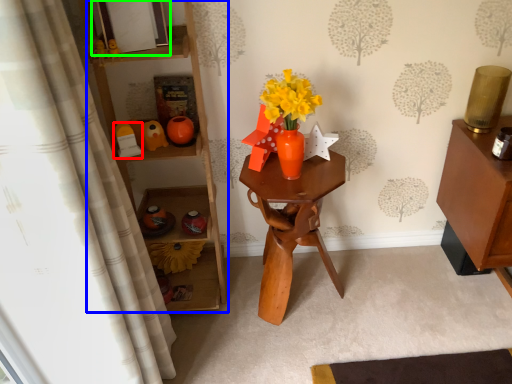
Question: Which is nearer to the toy (highlighted by a red box)? shelf (highlighted by a blue box) or picture frame (highlighted by a green box).

Choices:
 (A) shelf
 (B) picture frame

Answer: (A)